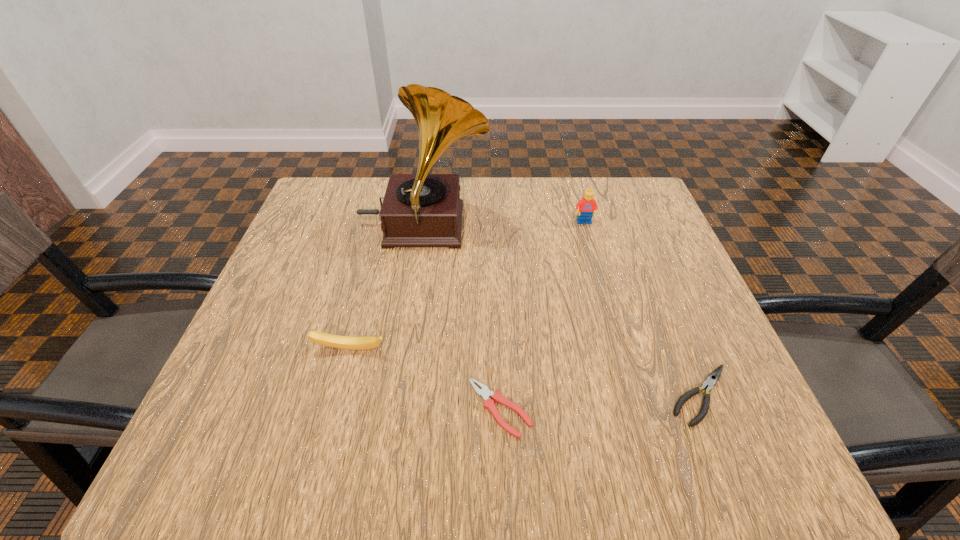
Where is `the tallest object`? This screenshot has height=540, width=960. the tallest object is located at coordinates (419, 210).

Where is `the fourth object from left to right`? the fourth object from left to right is located at coordinates (585, 207).

Where is `Lego`? This screenshot has width=960, height=540. Lego is located at coordinates (585, 207).

Identify the location of the third farthest object. (341, 342).

Where is `banana`? The height and width of the screenshot is (540, 960). banana is located at coordinates (341, 342).

This screenshot has width=960, height=540. Find the location of `the right pliers`. the right pliers is located at coordinates (712, 379).

Locate an element on the screen. This screenshot has height=540, width=960. the shortest object is located at coordinates (485, 393).

I want to click on the left pliers, so click(485, 393).

Image resolution: width=960 pixels, height=540 pixels. Identify the location of free space located 0.250m from the horn of the tallest object. (590, 226).

Locate an element on the screen. Image resolution: width=960 pixels, height=540 pixels. free space located 0.050m on the face of the fourth shortest object is located at coordinates (588, 239).